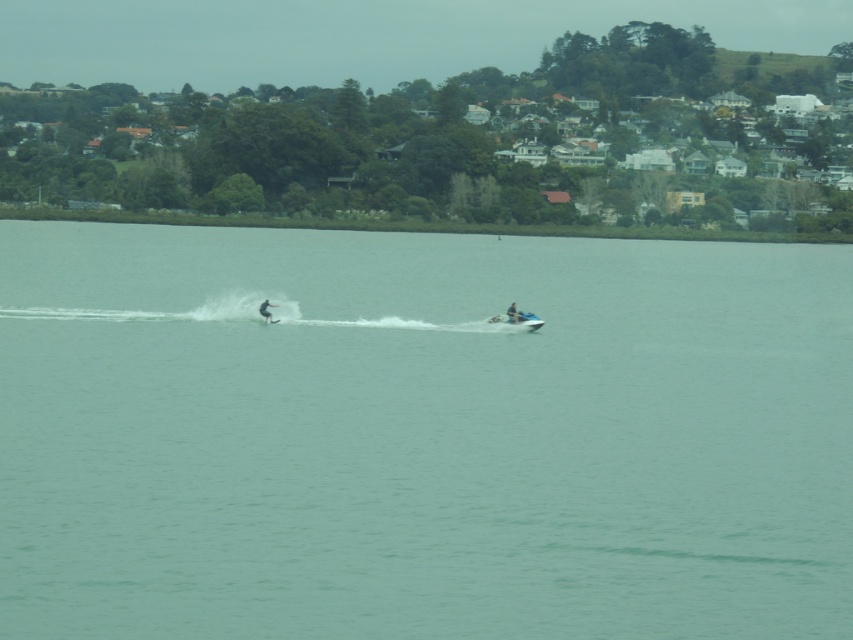
Which is in front, point (531, 317) or point (265, 301)?

Point (265, 301)

What do you see at coordinates (518, 321) in the screenshot? This screenshot has width=853, height=640. I see `white plastic boat at center` at bounding box center [518, 321].

The width and height of the screenshot is (853, 640). I want to click on white plastic boat at center, so click(518, 321).

Is clear water at center wider than white matte surfboard at center?

Yes.

Describe the element at coordinates (421, 435) in the screenshot. I see `clear water at center` at that location.

Who is more distant from viewer, (619, 416) or (265, 308)?

Point (265, 308)

Where is `clear water at center`? clear water at center is located at coordinates (421, 435).

Does clear water at center come in front of white plastic boat at center?

Yes, it is in front of white plastic boat at center.

Locate an element on the screen. The image size is (853, 640). clear water at center is located at coordinates (421, 435).

At what (x,y) coordinates should I click in order to perform the action: click on clear water at center. Please return your answer as a coordinate pair (x, y). Image resolution: width=853 pixels, height=640 pixels. Looking at the image, I should click on (421, 435).